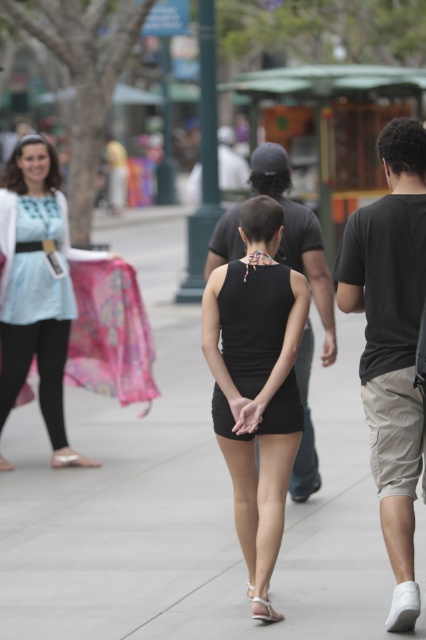
Question: Which of the following is the closest to the observer?

Choices:
 (A) white leather sandal at lower center
 (B) black matte dress at center
 (C) smooth concrete sidewalk at center
 (D) matte black hand at center

Answer: (C)

Question: Which point appears farthest from the camera in this image?

Choices:
 (A) [290, 266]
 (B) [54, 461]

Answer: (B)

Question: Among these objects, which one is nearest to the camera?

Choices:
 (A) white leather sandal at lower center
 (B) black matte dress at center

Answer: (B)

Question: Is matte blue dress at left above white leather sandal at lower center?

Choices:
 (A) yes
 (B) no

Answer: (A)

Question: Does smooth concrete sidewalk at center appear on the right side of white leather sandal at lower left?

Choices:
 (A) no
 (B) yes

Answer: (B)

Question: Is matte light blue dress at left further to camera compared to white leather sandal at center?

Choices:
 (A) yes
 (B) no

Answer: (A)